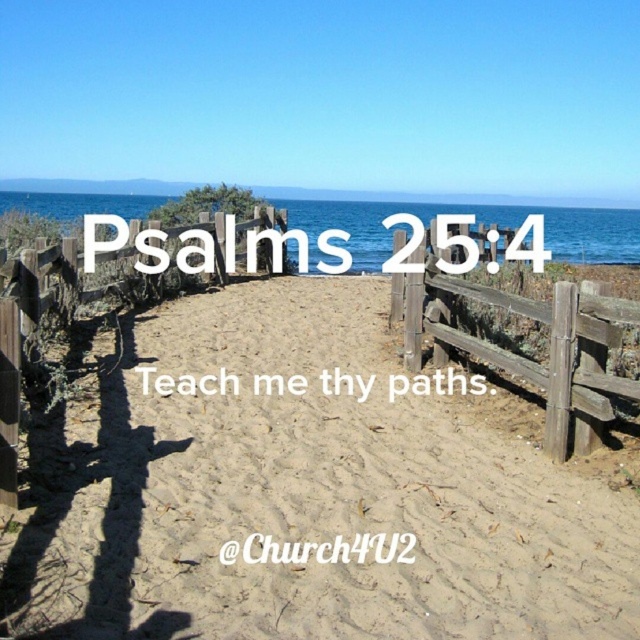
Which of these two, weathered wood fence at center or wooden fence at center, stands shorter?

weathered wood fence at center

At what (x,y) coordinates should I click in order to perform the action: click on weathered wood fence at center. Please return your answer as a coordinate pair (x, y). The height and width of the screenshot is (640, 640). Looking at the image, I should click on (522, 356).

You are a GUI agent. You are given a task and a screenshot of the screen. Output one action in this format:
    pyautogui.click(x=<x>, y=<y>)
    Task: Click on the weathered wood fence at center
    The image size is (640, 640).
    Given the screenshot: What is the action you would take?
    pyautogui.click(x=522, y=356)

Can you confirm if brown sandy path at center is taller than weathered wood fence at center?

In fact, brown sandy path at center may be shorter than weathered wood fence at center.

Find the location of a particular element. The image size is (640, 640). brown sandy path at center is located at coordinates (308, 496).

Where is `brown sandy path at center`? The width and height of the screenshot is (640, 640). brown sandy path at center is located at coordinates (308, 496).

Is brown sandy path at center shorter than wooden fence at center?

Yes.

Between point (54, 522) and point (22, 289), which one is positioned in front?

Point (54, 522) is in front.

Locate an element on the screen. brown sandy path at center is located at coordinates tap(308, 496).